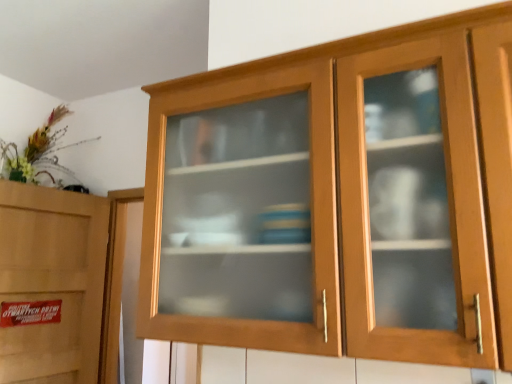
Question: From the image's perspective, is wooden cabinet at center located above or below matte wood cabinet at left?

Choices:
 (A) above
 (B) below

Answer: (A)

Question: Is point (450, 34) positioned closer to the camera than point (20, 243)?

Choices:
 (A) closer
 (B) farther

Answer: (A)

Question: Is wooden cabinet at center situated inside matte wood cabinet at left or outside?

Choices:
 (A) inside
 (B) outside

Answer: (B)

Question: In the image, is matte wood cabinet at left positioned in front of or behind wooden cabinet at center?

Choices:
 (A) behind
 (B) front

Answer: (A)

Question: Is point (26, 286) closer or farther from the camera than point (236, 87)?

Choices:
 (A) closer
 (B) farther

Answer: (B)

Question: Looking at the image, does matte wood cabinet at left seem bigger or smaller compared to wooden cabinet at center?

Choices:
 (A) small
 (B) big

Answer: (A)

Question: In the image, is matte wood cabinet at left on the left side or the right side of wooden cabinet at center?

Choices:
 (A) right
 (B) left

Answer: (B)